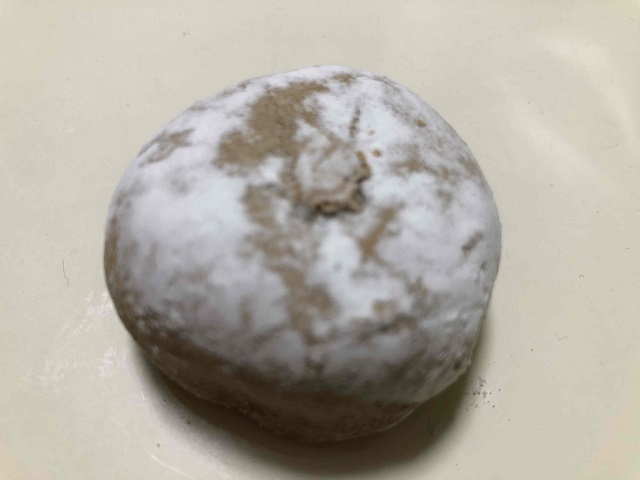
The image size is (640, 480). In order to click on table in this screenshot , I will do point(548,289).